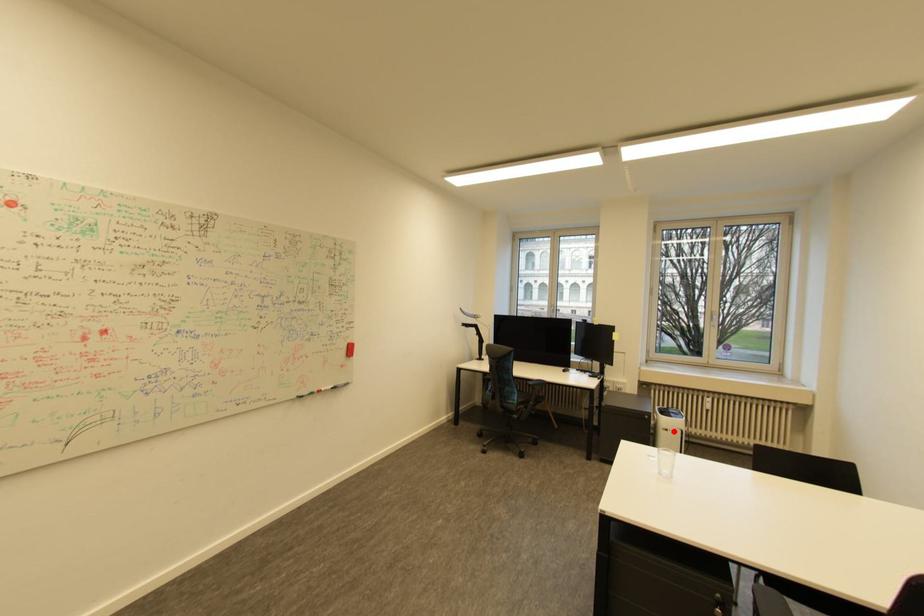
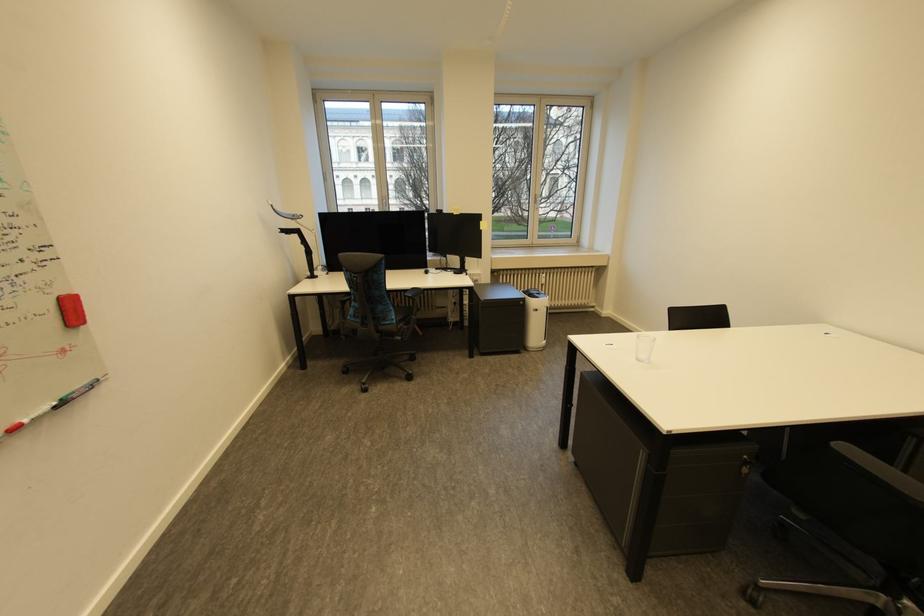
Question: I am providing you with two images of the same scene from different viewpoints. A red point is marked on the first image. Can you still see the location of the red point in image 2?

Choices:
 (A) Yes
 (B) No

Answer: (A)